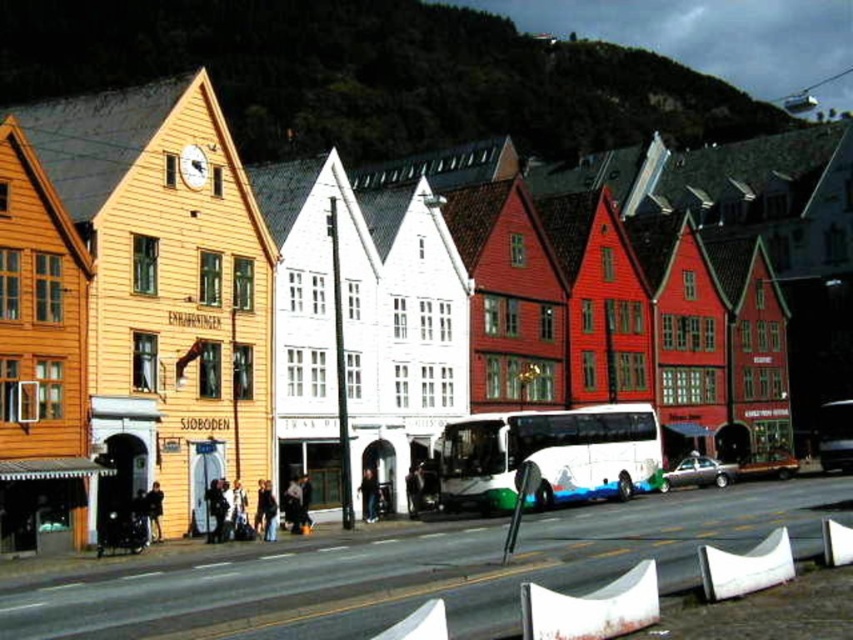
The width and height of the screenshot is (853, 640). Describe the element at coordinates (549, 456) in the screenshot. I see `white glossy bus at center` at that location.

Who is positioned more to the right, white glossy bus at center or silver metallic sedan at center?

Positioned to the right is silver metallic sedan at center.

The image size is (853, 640). I want to click on white glossy bus at center, so click(549, 456).

Is silver metallic sedan at center closer to camera compared to metallic silver car at center?

Yes, it is.

Based on the photo, who is shorter, silver metallic sedan at center or metallic silver car at center?

metallic silver car at center

At what (x,y) coordinates should I click in order to perform the action: click on silver metallic sedan at center. Please return your answer as a coordinate pair (x, y). Looking at the image, I should click on (698, 474).

Does white glossy bus at center have a smaller size compared to metallic silver car at center?

No.

Image resolution: width=853 pixels, height=640 pixels. What do you see at coordinates (549, 456) in the screenshot? I see `white glossy bus at center` at bounding box center [549, 456].

I want to click on white glossy bus at center, so click(549, 456).

Where is `white glossy bus at center`? This screenshot has height=640, width=853. white glossy bus at center is located at coordinates (549, 456).